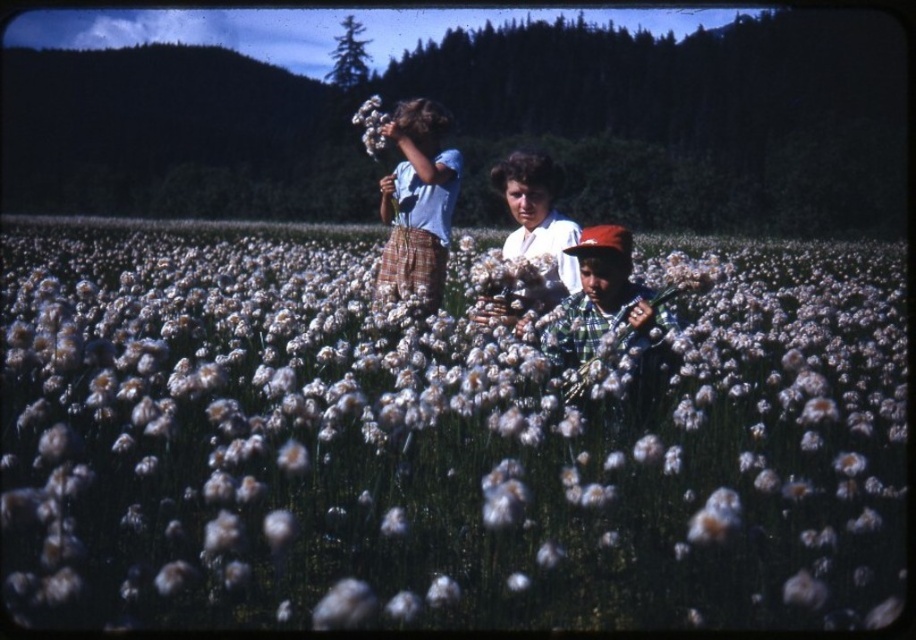
Is white fluffy flowers at center shorter than light blue cotton shirt at upper center?

No, white fluffy flowers at center is not shorter than light blue cotton shirt at upper center.

Does point (569, 486) lie behind point (417, 280)?

No, it is not.

This screenshot has height=640, width=916. In order to click on white fluffy flowers at center in this screenshot , I will do (439, 442).

Is white cotton at center below white fluffy flower at center?

Yes.

Is white cotton at center shorter than white fluffy flower at center?

Yes.

The height and width of the screenshot is (640, 916). Describe the element at coordinates (536, 212) in the screenshot. I see `white cotton at center` at that location.

Where is `white cotton at center`? The width and height of the screenshot is (916, 640). white cotton at center is located at coordinates (536, 212).

Who is more distant from viewer, (655,372) or (576,276)?

The point (576,276) is behind.

Looking at this image, between plaid flannel shirt at center and white cotton at center, which one is positioned higher?

white cotton at center

Locate an element on the screen. The width and height of the screenshot is (916, 640). plaid flannel shirt at center is located at coordinates (609, 310).

Identify the location of plaid flannel shirt at center. (609, 310).